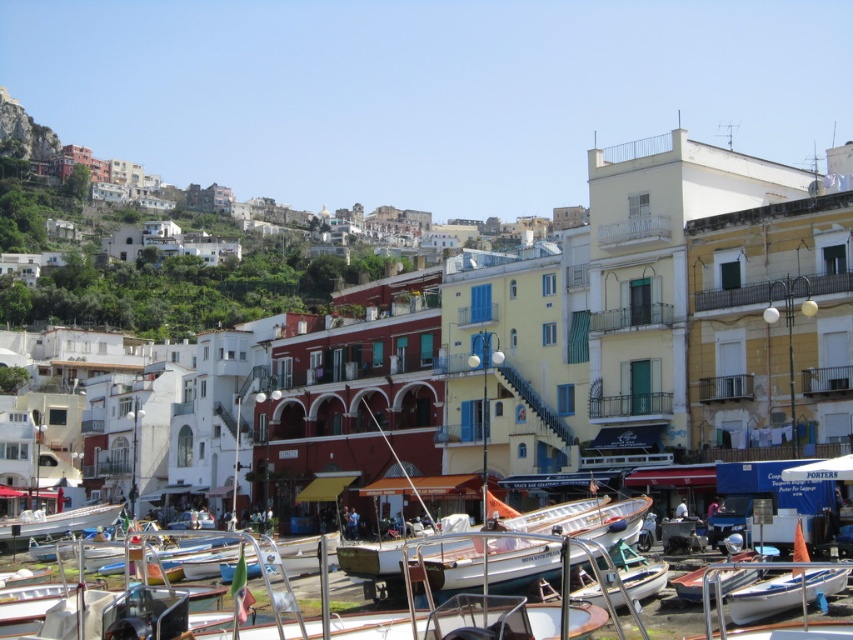
Question: Where is white glossy boat at lower right located in relation to white wooden boat at lower right in the image?

Choices:
 (A) above
 (B) below

Answer: (A)

Question: Which of these objects is positioned closest to the white wooden boat at lower right?

Choices:
 (A) white glossy boat at lower right
 (B) white matte building at center
 (C) white glossy boat at lower left

Answer: (A)

Question: Which object appears closest to the camera in this image?

Choices:
 (A) white glossy boat at lower right
 (B) white matte building at center
 (C) white glossy boat at lower left
 (D) white wooden boat at lower right

Answer: (A)

Question: Is white matte building at center thinner than white glossy boat at lower left?

Choices:
 (A) no
 (B) yes

Answer: (A)

Question: Does white matte building at center have a lesser width compared to white glossy boat at lower left?

Choices:
 (A) yes
 (B) no

Answer: (B)

Question: Which point is farther from the camera taking this photo?

Choices:
 (A) (757, 570)
 (B) (529, 339)

Answer: (B)